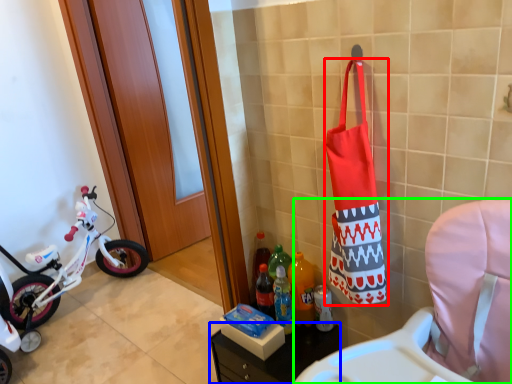
Question: Estimate the real-world distances between objects in this image. Which object is farther from pouch (highlighted by a red box), furniture (highlighted by a blue box) or rocking chair (highlighted by a green box)?

Choices:
 (A) furniture
 (B) rocking chair

Answer: (A)